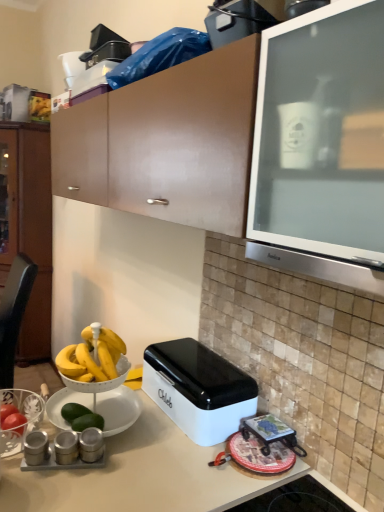
Question: Which direction should I rotate to look at white plastic appliance at upper center, which is counted as the first appliance, starting from the top?

Choices:
 (A) left
 (B) right

Answer: (A)

Question: From the image's perspective, is matte black toaster at upper center, positioned as the 5th appliance in bottom-to-top order, under satin silver canisters at lower left, marked as the 5th appliance in a back-to-front arrangement?

Choices:
 (A) yes
 (B) no

Answer: (B)

Question: Is matte black toaster at upper center, the fifth appliance positioned from the front, aimed at satin silver canisters at lower left, marked as the 5th appliance in a back-to-front arrangement?

Choices:
 (A) no
 (B) yes

Answer: (A)

Question: Does matte black toaster at upper center, the 2th appliance viewed from the back, come in front of satin silver canisters at lower left, acting as the 2th appliance starting from the front?

Choices:
 (A) yes
 (B) no

Answer: (B)

Question: Is matte black toaster at upper center, the 2th appliance viewed from the back, completely or partially outside of satin silver canisters at lower left, which is the 5th appliance in top-to-bottom order?

Choices:
 (A) no
 (B) yes

Answer: (B)

Question: Is matte black toaster at upper center, which appears as the second appliance when viewed from the top, wider than satin silver canisters at lower left, which is the 5th appliance in top-to-bottom order?

Choices:
 (A) yes
 (B) no

Answer: (A)

Question: Can you confirm if matte black toaster at upper center, which appears as the second appliance when viewed from the top, is shorter than satin silver canisters at lower left, marked as the 5th appliance in a back-to-front arrangement?

Choices:
 (A) no
 (B) yes

Answer: (A)

Question: Is satin silver canisters at lower left, acting as the 2th appliance starting from the front, next to white plastic appliance at upper center, which is counted as the first appliance, starting from the top, and touching it?

Choices:
 (A) yes
 (B) no

Answer: (B)

Question: From the image's perspective, is satin silver canisters at lower left, which ranks as the second appliance in bottom-to-top order, below white plastic appliance at upper center, arranged as the first appliance when viewed from the back?

Choices:
 (A) no
 (B) yes

Answer: (B)

Question: Is white plastic appliance at upper center, arranged as the first appliance when viewed from the back, at the back of satin silver canisters at lower left, which is the 5th appliance in top-to-bottom order?

Choices:
 (A) yes
 (B) no

Answer: (B)

Question: From a real-world perspective, is satin silver canisters at lower left, which ranks as the second appliance in bottom-to-top order, over white plastic appliance at upper center, arranged as the first appliance when viewed from the back?

Choices:
 (A) yes
 (B) no

Answer: (B)

Question: Is white plastic appliance at upper center, marked as the sixth appliance in a front-to-back arrangement, surrounded by satin silver canisters at lower left, marked as the 5th appliance in a back-to-front arrangement?

Choices:
 (A) yes
 (B) no

Answer: (B)

Question: Considering the relative positions of satin silver canisters at lower left, which ranks as the second appliance in bottom-to-top order, and white plastic appliance at upper center, marked as the sixth appliance in a front-to-back arrangement, in the image provided, is satin silver canisters at lower left, which ranks as the second appliance in bottom-to-top order, to the left of white plastic appliance at upper center, marked as the sixth appliance in a front-to-back arrangement, from the viewer's perspective?

Choices:
 (A) yes
 (B) no

Answer: (B)

Question: From the image's perspective, would you say metallic silver canisters at lower left, the 6th appliance positioned from the back, is shown under matte black toaster at upper center, positioned as the 5th appliance in bottom-to-top order?

Choices:
 (A) no
 (B) yes

Answer: (B)